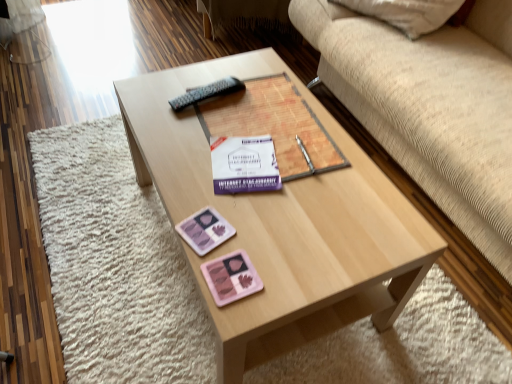
Locate an element on the screen. This screenshot has width=512, height=384. free space between white paper at center and pink matte eyeshadow palette at center, arranged as the second currency when ordered from the bottom is located at coordinates 218,203.